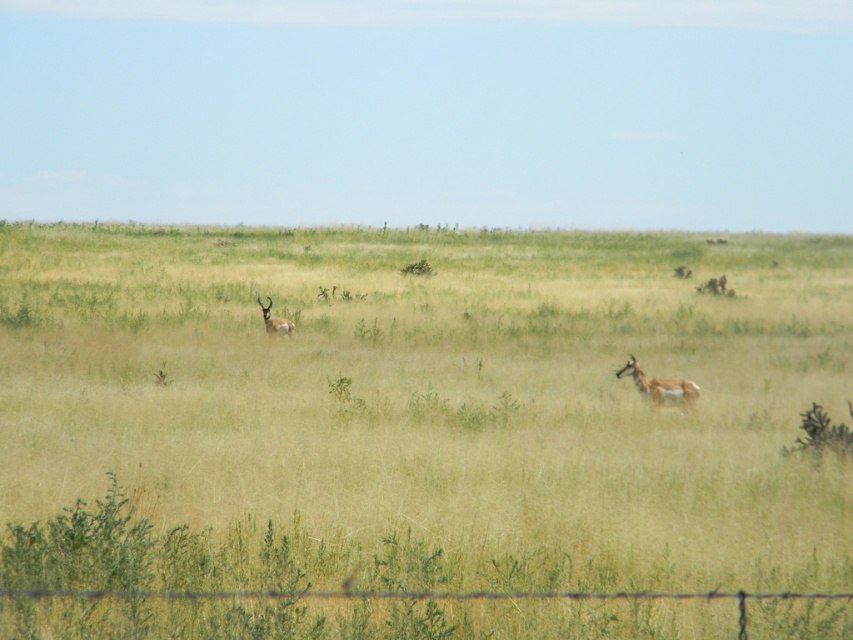
You are a wildlife photographer trying to capture a photo of both the spotted fur antelope at center and the brown fur antelope at left. Based on their positions, which antelope is positioned more to the left side of the frame?

The brown fur antelope at left is positioned more to the left side of the frame than the spotted fur antelope at center.